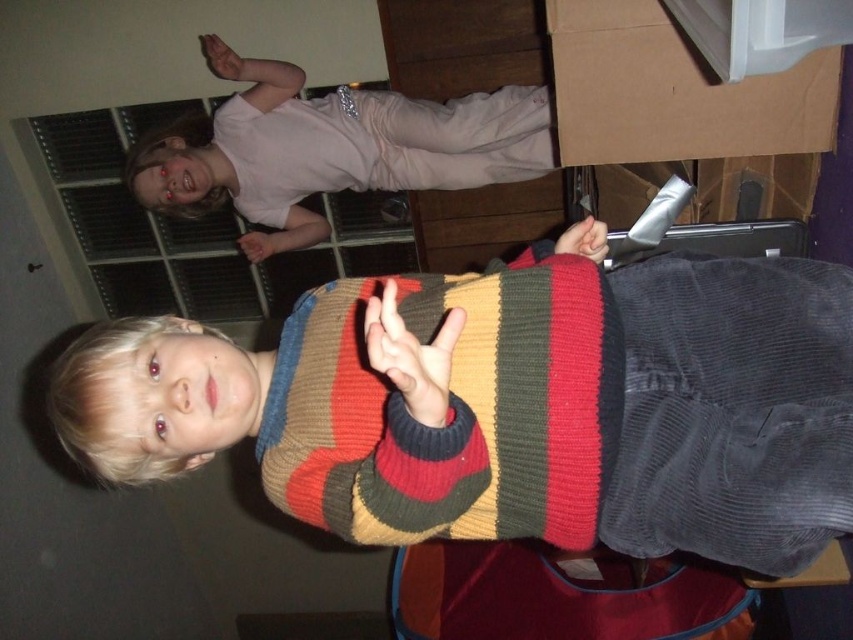
Can you confirm if striped sweater at center is positioned to the left of matte pink shirt at upper left?

In fact, striped sweater at center is to the right of matte pink shirt at upper left.

Is striped sweater at center further to camera compared to matte pink shirt at upper left?

No, striped sweater at center is in front of matte pink shirt at upper left.

Which is behind, point (94, 436) or point (421, 113)?

Positioned behind is point (421, 113).

Locate an element on the screen. Image resolution: width=853 pixels, height=640 pixels. striped sweater at center is located at coordinates (512, 404).

Between point (399, 294) and point (485, 470), which one is positioned in front?

Point (485, 470)

Can you confirm if striped sweater at center is wider than striped wool sweater at center?

Correct, the width of striped sweater at center exceeds that of striped wool sweater at center.

You are a GUI agent. You are given a task and a screenshot of the screen. Output one action in this format:
    pyautogui.click(x=<x>, y=<y>)
    Task: Click on the striped sweater at center
    
    Given the screenshot: What is the action you would take?
    pyautogui.click(x=512, y=404)

Can you confirm if striped wool sweater at center is positioned above matte pink shirt at upper left?

Actually, striped wool sweater at center is below matte pink shirt at upper left.

From the picture: Which is more to the left, striped wool sweater at center or matte pink shirt at upper left?

From the viewer's perspective, matte pink shirt at upper left appears more on the left side.

Find the location of `striped wool sweater at center`. striped wool sweater at center is located at coordinates (451, 408).

At what (x,y) coordinates should I click in order to perform the action: click on striped wool sweater at center. Please return your answer as a coordinate pair (x, y). The width and height of the screenshot is (853, 640). Looking at the image, I should click on (451, 408).